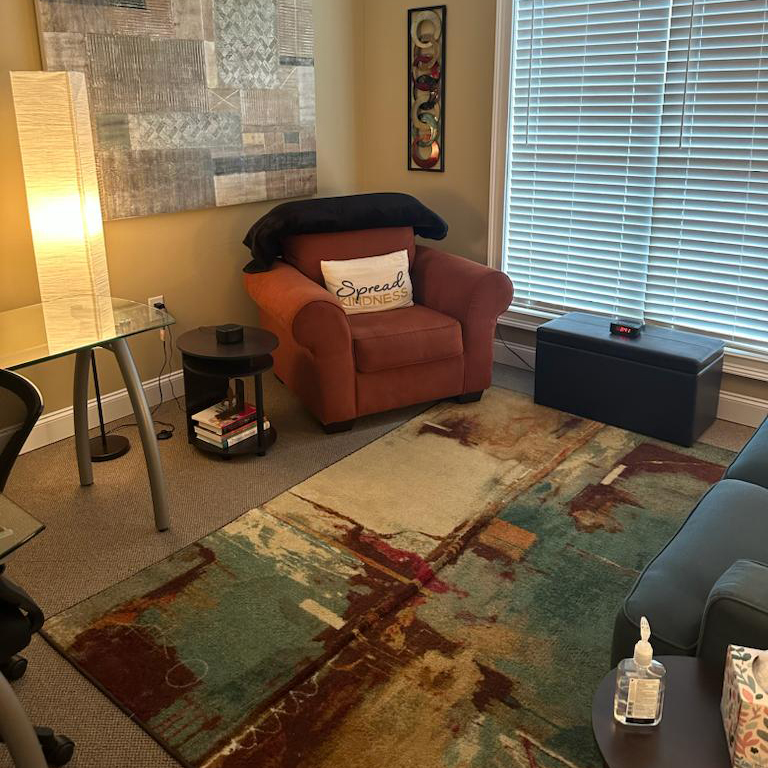
Image resolution: width=768 pixels, height=768 pixels. In order to click on pillow in this screenshot , I will do `click(368, 293)`.